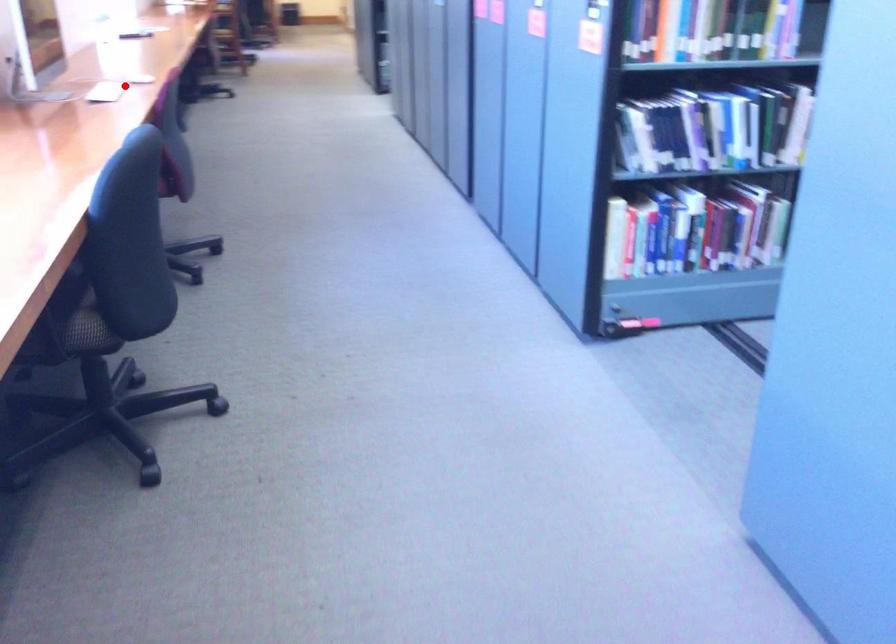
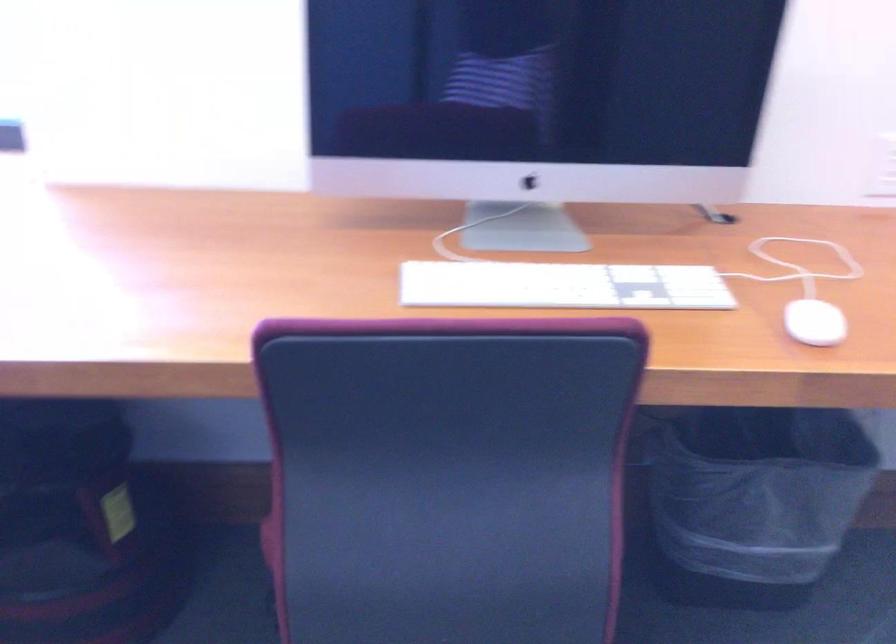
Where in the second image is the point corresponding to the highlighted location from the first image?

(562, 285)